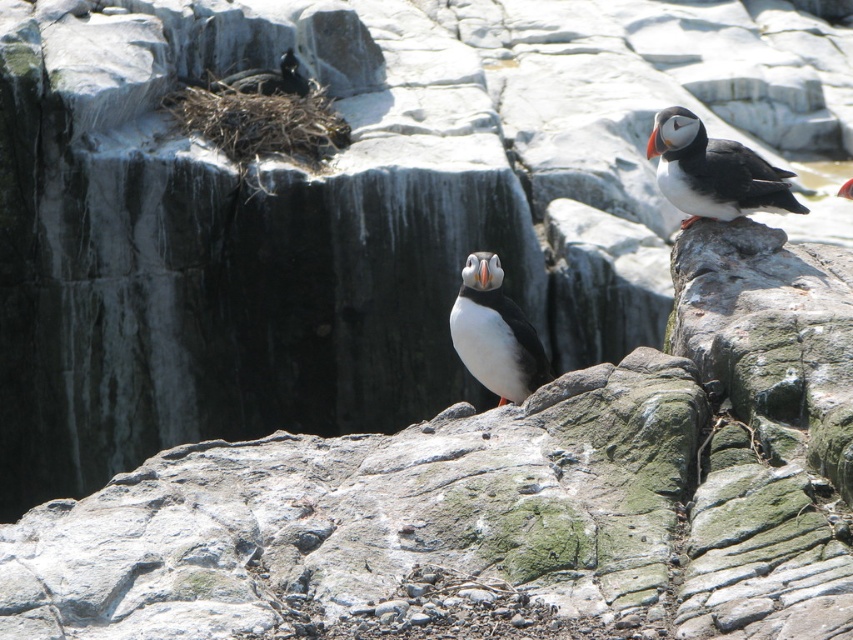
Question: Can you confirm if black matte puffin at right is positioned to the right of white matte puffin at center?

Choices:
 (A) no
 (B) yes

Answer: (B)

Question: Among these objects, which one is farthest from the camera?

Choices:
 (A) black matte puffin at right
 (B) white matte puffin at center

Answer: (A)

Question: Which point is farther from the camera taking this photo?

Choices:
 (A) (471, 275)
 (B) (770, 170)

Answer: (B)

Question: Can you confirm if black matte puffin at right is bigger than white matte puffin at center?

Choices:
 (A) no
 (B) yes

Answer: (B)

Question: Considering the relative positions of black matte puffin at right and white matte puffin at center in the image provided, where is black matte puffin at right located with respect to white matte puffin at center?

Choices:
 (A) left
 (B) right

Answer: (B)